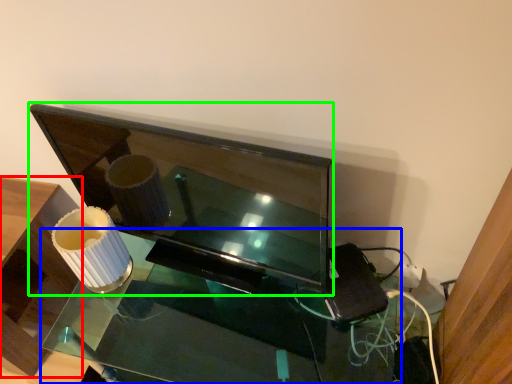
Question: Estimate the real-world distances between objects in this image. Which object is closer to furniture (highlighted by a red box), table (highlighted by a blue box) or television (highlighted by a green box)?

Choices:
 (A) table
 (B) television

Answer: (A)